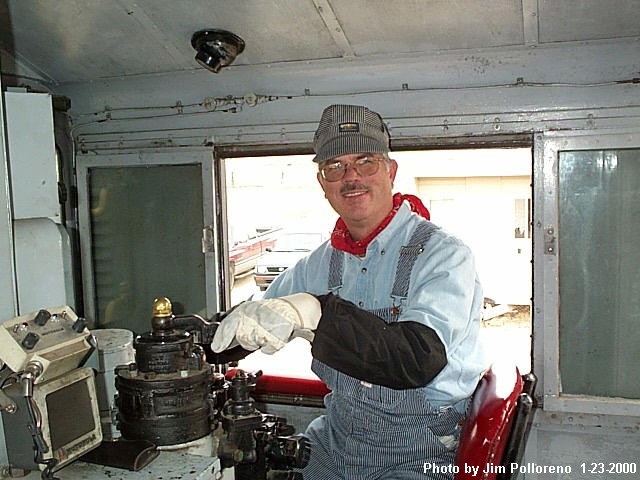
At what (x,y) coordinates should I click in order to perform the action: click on small screen. Please return your answer as a coordinate pair (x, y). The image size is (640, 480). Looking at the image, I should click on [x=58, y=424].